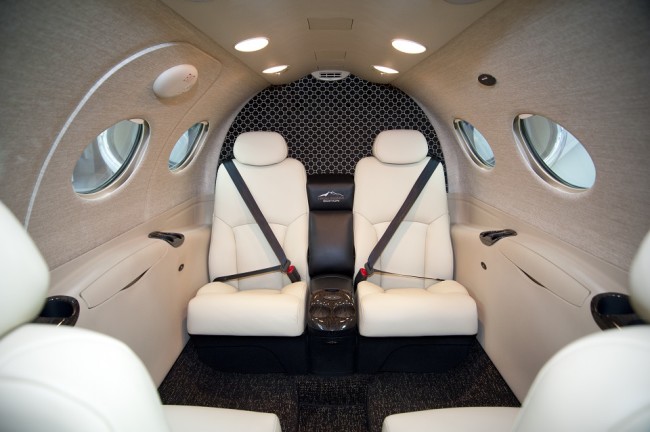
Locate an element on the screen. The height and width of the screenshot is (432, 650). seats is located at coordinates (563, 401), (220, 427), (279, 298), (450, 292).